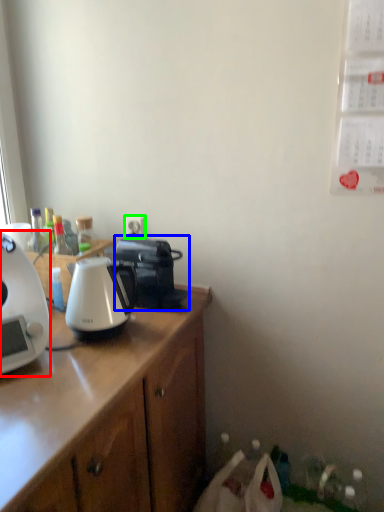
Question: Based on their relative distances, which object is nearer to coffee maker (highlighted by a red box)? Choose from coffee maker (highlighted by a blue box) and power outlet (highlighted by a green box).

Choices:
 (A) coffee maker
 (B) power outlet

Answer: (A)